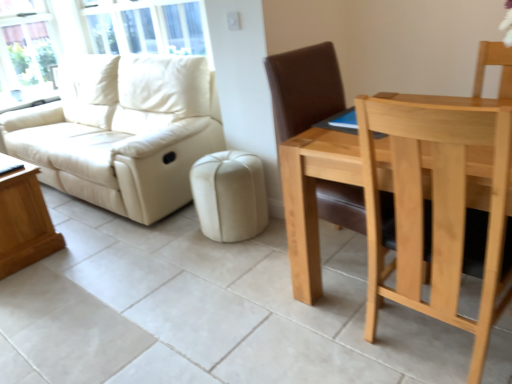
Question: From their relative heights in the image, would you say matte cream leather couch at left is taller or shorter than light brown wooden coffee table at lower left?

Choices:
 (A) tall
 (B) short

Answer: (A)

Question: Would you say matte cream leather couch at left is inside or outside light brown wooden coffee table at lower left?

Choices:
 (A) inside
 (B) outside

Answer: (B)

Question: Based on their relative distances, which object is farther from the light brown wood chair at right?

Choices:
 (A) beige leather ottoman at center
 (B) matte cream leather couch at left
 (C) light brown wooden coffee table at lower left
 (D) transparent glass window at upper left

Answer: (D)

Question: Which of these objects is positioned closest to the transparent glass window at upper left?

Choices:
 (A) light brown wooden coffee table at lower left
 (B) light brown wood chair at right
 (C) beige leather ottoman at center
 (D) matte cream leather couch at left

Answer: (D)